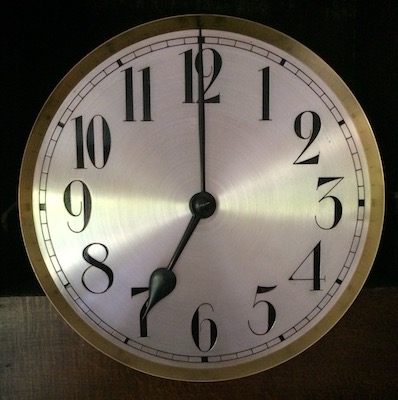
The width and height of the screenshot is (398, 400). I want to click on gold edge of clock, so click(205, 373).